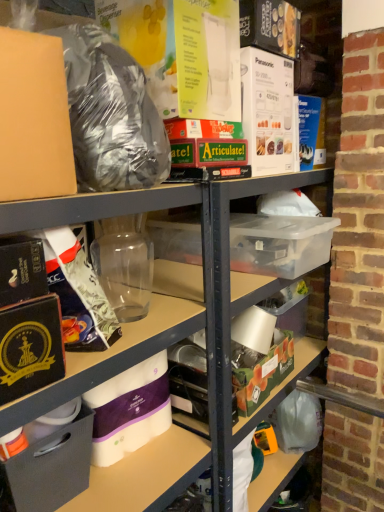
Question: Can you confirm if matte black bag at upper left is taller than green matte box at center, the 1th box viewed from the back?

Choices:
 (A) yes
 (B) no

Answer: (A)

Question: From a real-world perspective, is matte black bag at upper left located higher than green matte box at center, acting as the 1th box starting from the right?

Choices:
 (A) yes
 (B) no

Answer: (A)

Question: Can you confirm if matte black bag at upper left is thinner than green matte box at center, the 1th box viewed from the back?

Choices:
 (A) yes
 (B) no

Answer: (B)

Question: Is matte black bag at upper left completely or partially outside of green matte box at center, the 1th box viewed from the back?

Choices:
 (A) no
 (B) yes

Answer: (B)

Question: Is matte black bag at upper left not near green matte box at center, acting as the 1th box starting from the right?

Choices:
 (A) yes
 (B) no

Answer: (B)

Question: Is matte black bag at upper left to the left of green matte box at center, the 1th box viewed from the back, from the viewer's perspective?

Choices:
 (A) yes
 (B) no

Answer: (A)

Question: Can you confirm if matte black bag at upper left is bigger than matte black box at lower left, arranged as the 2th box when viewed from the back?

Choices:
 (A) yes
 (B) no

Answer: (A)

Question: Is matte black bag at upper left shorter than matte black box at lower left, marked as the first box in a left-to-right arrangement?

Choices:
 (A) yes
 (B) no

Answer: (B)

Question: Is matte black bag at upper left facing away from matte black box at lower left, positioned as the second box in right-to-left order?

Choices:
 (A) no
 (B) yes

Answer: (A)

Question: Could you tell me if matte black bag at upper left is turned towards matte black box at lower left, arranged as the 2th box when viewed from the back?

Choices:
 (A) yes
 (B) no

Answer: (B)

Question: Considering the relative sizes of matte black bag at upper left and matte black box at lower left, which ranks as the first box in front-to-back order, in the image provided, is matte black bag at upper left wider than matte black box at lower left, which ranks as the first box in front-to-back order,?

Choices:
 (A) no
 (B) yes

Answer: (A)

Question: Does matte black bag at upper left appear on the right side of matte black box at lower left, which ranks as the first box in front-to-back order?

Choices:
 (A) yes
 (B) no

Answer: (A)

Question: Does green matte box at center, the 1th box viewed from the back, turn towards white matte toilet paper at lower center?

Choices:
 (A) no
 (B) yes

Answer: (A)